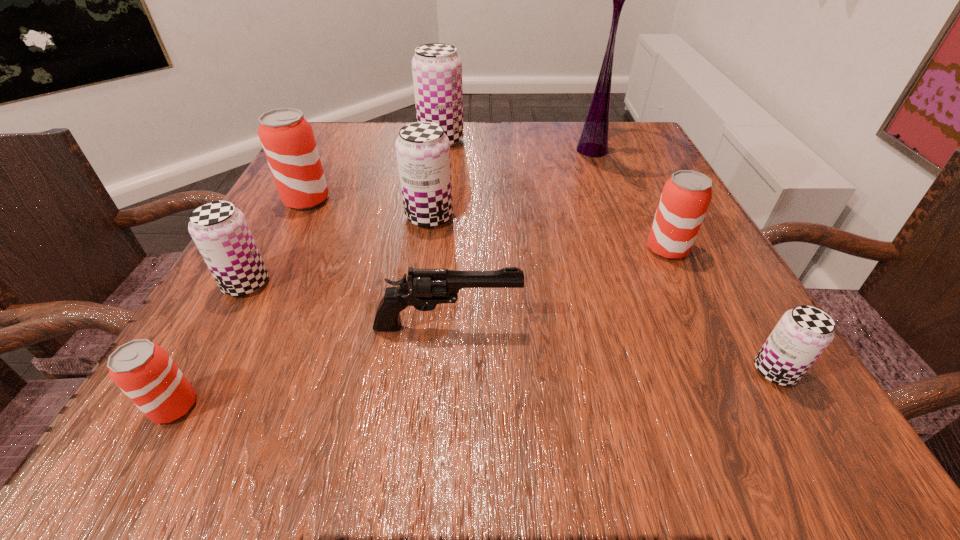
This screenshot has width=960, height=540. Identify the location of purple beer can that is the closest one to the farthest beer can. (423, 149).

Locate an element on the screen. The width and height of the screenshot is (960, 540). orange beer can that can be found as the third closest to the second biggest purple beer can is located at coordinates (143, 370).

The image size is (960, 540). I want to click on orange beer can that is the third closest to the farthest purple beer can, so click(143, 370).

Identify the location of vacant point that satisfies the following two spatial constraints: 1. on the front side of the farthest orange beer can; 2. on the right side of the rightmost purple beer can. The height and width of the screenshot is (540, 960). (218, 371).

Where is `vacant space that satisfies the following two spatial constraints: 1. on the back side of the farthest orange beer can; 2. on the left side of the second nearest purple beer can`? vacant space that satisfies the following two spatial constraints: 1. on the back side of the farthest orange beer can; 2. on the left side of the second nearest purple beer can is located at coordinates (293, 200).

Where is `free point that satisfies the following two spatial constraints: 1. on the front-facing side of the nearest purple beer can; 2. on the left side of the tallest object`? The width and height of the screenshot is (960, 540). free point that satisfies the following two spatial constraints: 1. on the front-facing side of the nearest purple beer can; 2. on the left side of the tallest object is located at coordinates (679, 371).